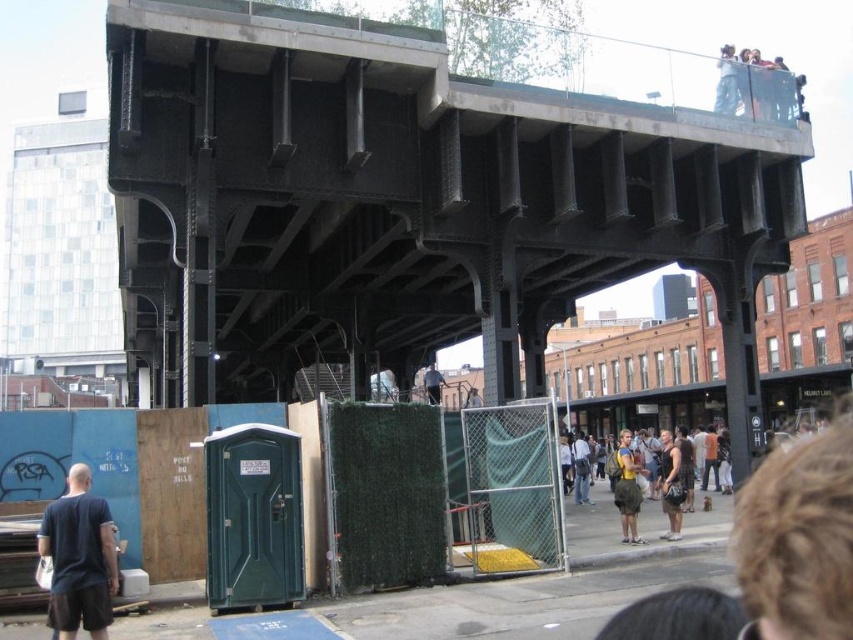
Question: Is khaki canvas backpack at center below matte black jacket at upper center?

Choices:
 (A) no
 (B) yes

Answer: (B)

Question: Does dark blue t-shirt at lower left have a lesser width compared to green fabric skirt at center?

Choices:
 (A) yes
 (B) no

Answer: (A)

Question: Is black steel bridge at upper center below green fabric skirt at center?

Choices:
 (A) no
 (B) yes

Answer: (A)

Question: Which point is closer to the camera?

Choices:
 (A) black steel bridge at upper center
 (B) green fabric skirt at center
 (C) dark blue t-shirt at lower left

Answer: (C)

Question: Based on their relative distances, which object is nearer to the green fabric skirt at center?

Choices:
 (A) khaki canvas backpack at center
 (B) dark blue t-shirt at lower left

Answer: (A)

Question: Which point is closer to the camera?

Choices:
 (A) (67, 518)
 (B) (637, 538)
 (C) (438, 380)

Answer: (A)